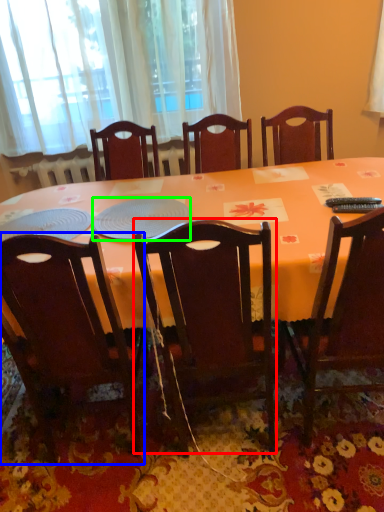
Question: Which object is the farthest from chair (highlighted by a red box)? Choose among these: chair (highlighted by a blue box) or platter (highlighted by a green box).

Choices:
 (A) chair
 (B) platter

Answer: (B)